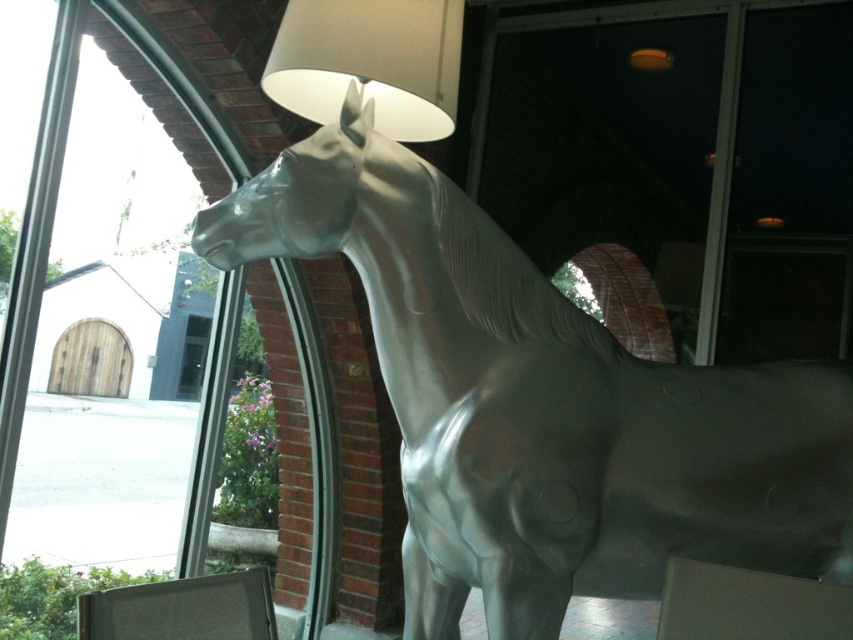
You are an architect designing a new exhibition space. You need to place a bench for visitors to sit and admire the shiny metallic horse at center. Where should you place the bench to ensure visitors can see the horse clearly?

The shiny metallic horse at center is positioned at point (543,404). To ensure clear visibility, the bench should be placed in an area that allows an unobstructed line of sight to this coordinate, likely in front or to the sides of the horse, avoiding any structural elements that might block the view.

You are an interior designer assessing the placement of the shiny metallic horse at center and the white matte lampshade at upper center. Based on their heights, which object would cast a longer shadow if the light source is directly above them?

The shiny metallic horse at center is taller than the white matte lampshade at upper center, so it would cast a longer shadow.